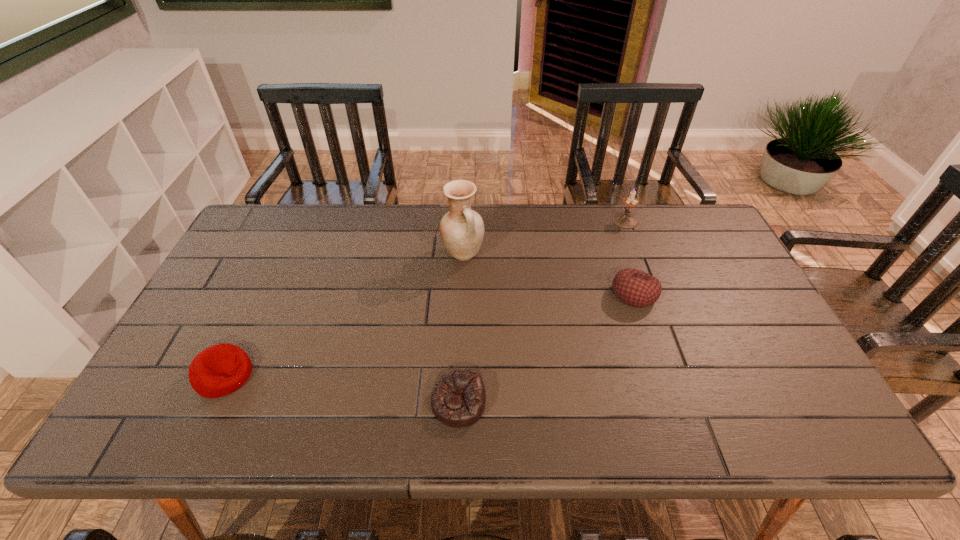
Locate an element on the screen. The image size is (960, 540). vacant position located on the left of the farthest object is located at coordinates (583, 221).

I want to click on vacant space located on the left of the rightmost beanbag, so click(x=564, y=294).

Find the location of `vacant region located 0.130m on the seat area of the leftmost object`. vacant region located 0.130m on the seat area of the leftmost object is located at coordinates (x=305, y=375).

Find the location of a particular element. vacant space located on the left of the second beanbag from left to right is located at coordinates (344, 403).

Locate an element on the screen. This screenshot has width=960, height=540. pottery that is positioned at the far edge is located at coordinates (461, 229).

Identify the location of candle holder located at the far edge. (625, 220).

This screenshot has width=960, height=540. Identify the location of object that is positioned at the near edge. (458, 399).

Where is `object that is at the left edge`? The image size is (960, 540). object that is at the left edge is located at coordinates (219, 370).

Image resolution: width=960 pixels, height=540 pixels. I want to click on vacant area at the far edge, so click(x=571, y=214).

Locate an element on the screen. vacant space at the near edge of the desktop is located at coordinates (631, 429).